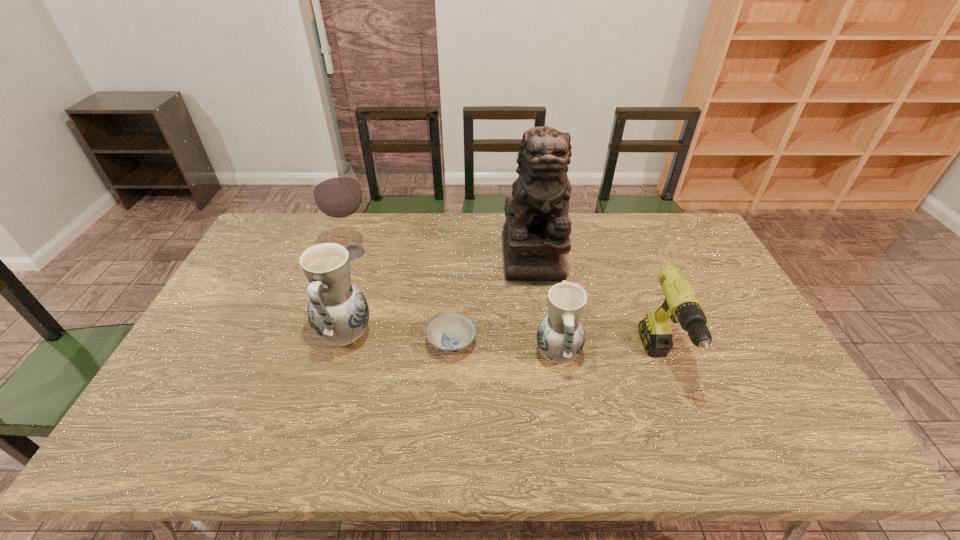
Locate an element on the screen. The image size is (960, 540). the taller pottery is located at coordinates (338, 313).

Locate an element on the screen. the right pottery is located at coordinates (561, 335).

Locate an element on the screen. alcohol is located at coordinates (337, 193).

At what (x,y) coordinates should I click in order to perform the action: click on sculpture. Please return your answer as a coordinate pair (x, y). Image resolution: width=960 pixels, height=540 pixels. Looking at the image, I should click on (536, 232).

The height and width of the screenshot is (540, 960). Identify the location of drill. (681, 304).

Where is `the third object from left to right`? This screenshot has height=540, width=960. the third object from left to right is located at coordinates (450, 332).

Identify the location of bowl. (450, 332).

The height and width of the screenshot is (540, 960). Identify the location of vacant space located 0.050m on either side of the left pottery. (300, 335).

Image resolution: width=960 pixels, height=540 pixels. In order to click on blank space located 0.130m on either side of the left pottery in this screenshot , I will do `click(273, 335)`.

Where is `vacant space situated 0.340m on either side of the left pottery`? vacant space situated 0.340m on either side of the left pottery is located at coordinates (198, 335).